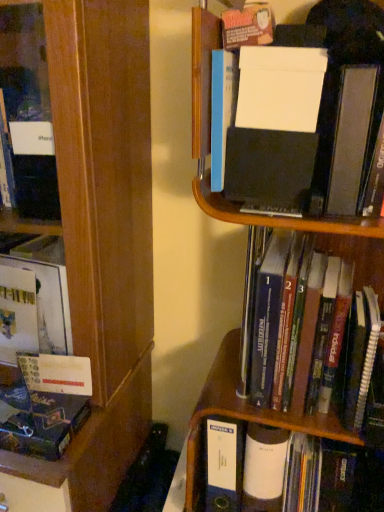
Question: Considering the positions of matte black book at lower left, which appears as the third book when viewed from the right, and hardcover book at center, which ranks as the 2th book in top-to-bottom order, in the image, is matte black book at lower left, which appears as the third book when viewed from the right, taller or shorter than hardcover book at center, which ranks as the 2th book in top-to-bottom order,?

Choices:
 (A) short
 (B) tall

Answer: (A)

Question: Is matte black book at lower left, the first book in the left-to-right sequence, wider or thinner than hardcover book at center, which ranks as the 2th book in top-to-bottom order?

Choices:
 (A) wide
 (B) thin

Answer: (B)

Question: Which is farther from the white matte folder at upper right, the 1th book in the top-to-bottom sequence?

Choices:
 (A) matte black book at lower left, marked as the 3th book in a top-to-bottom arrangement
 (B) hardcover book at center, which is the second book in bottom-to-top order
 (C) wooden bookcase at left

Answer: (A)

Question: Which object is the farthest from the white matte folder at upper right, arranged as the third book when ordered from the bottom?

Choices:
 (A) hardcover book at center, which ranks as the 2th book in top-to-bottom order
 (B) wooden bookcase at left
 (C) matte black book at lower left, the first book in the left-to-right sequence

Answer: (C)